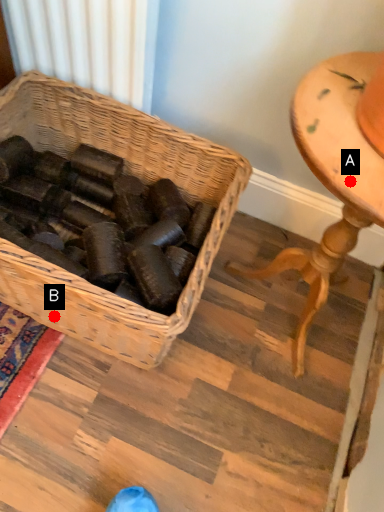
Question: Two points are circled on the image, labeled by A and B beside each circle. Which point is further to the camera?

Choices:
 (A) A is further
 (B) B is further

Answer: (B)